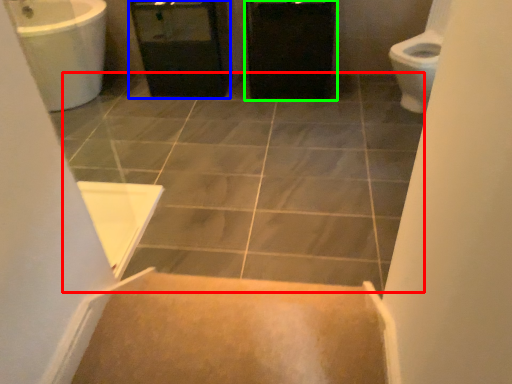
Question: Which object is the farthest from ceramic tile (highlighted by a red box)? Choose among these: screen door (highlighted by a blue box) or cabinetry (highlighted by a green box).

Choices:
 (A) screen door
 (B) cabinetry

Answer: (A)